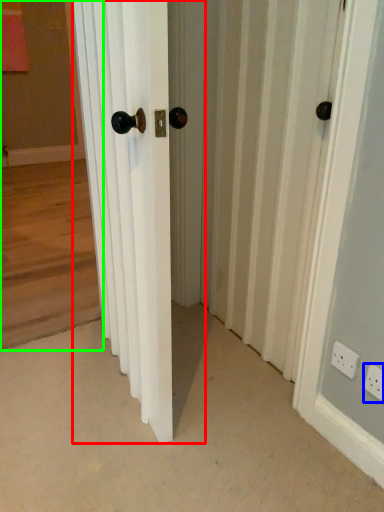
Question: Considering the real-world distances, which object is farthest from door (highlighted by a red box)? electric outlet (highlighted by a blue box) or corridor (highlighted by a green box)?

Choices:
 (A) electric outlet
 (B) corridor

Answer: (B)